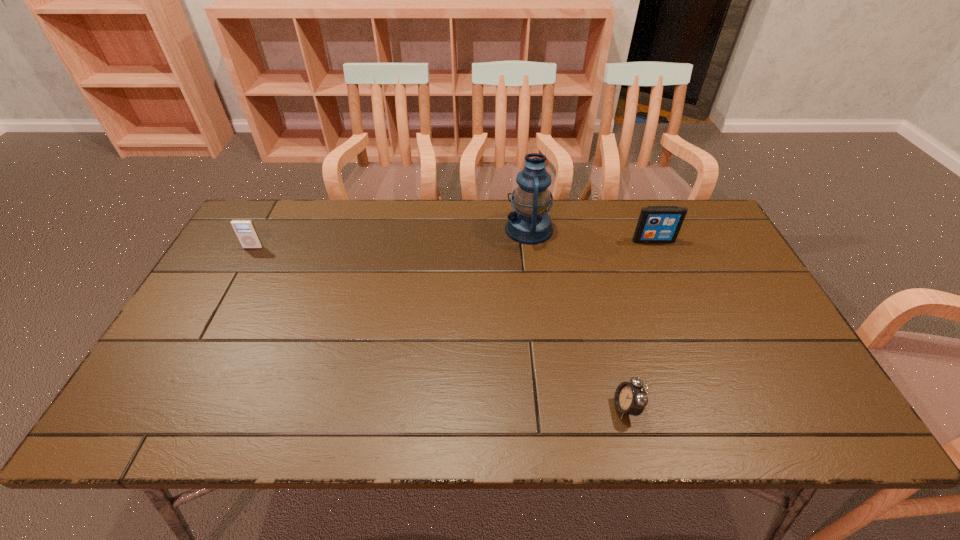
I want to click on vacant space located 0.120m on the face of the lantern, so click(468, 229).

At what (x,y) coordinates should I click in order to perform the action: click on blank space located 0.280m on the front screen of the farther iPod. Please return your answer as a coordinate pair (x, y). Image resolution: width=960 pixels, height=540 pixels. Looking at the image, I should click on (684, 313).

Identify the location of vacant region located on the front-facing side of the left iPod. The height and width of the screenshot is (540, 960). (237, 276).

Locate an element on the screen. Image resolution: width=960 pixels, height=540 pixels. vacant space located on the face of the second object from right to left is located at coordinates (582, 407).

Where is `free region located on the face of the second object from right to left`? This screenshot has height=540, width=960. free region located on the face of the second object from right to left is located at coordinates (554, 407).

I want to click on vacant region located 0.090m on the face of the second object from right to left, so click(572, 407).

Locate an element on the screen. This screenshot has width=960, height=540. lantern that is at the far edge is located at coordinates (529, 223).

Where is `object positioned at the near edge`? This screenshot has height=540, width=960. object positioned at the near edge is located at coordinates (630, 398).

The image size is (960, 540). What are the coordinates of `object that is at the left edge` in the screenshot? It's located at (245, 230).

The height and width of the screenshot is (540, 960). Identify the location of object located at the right edge. (657, 224).